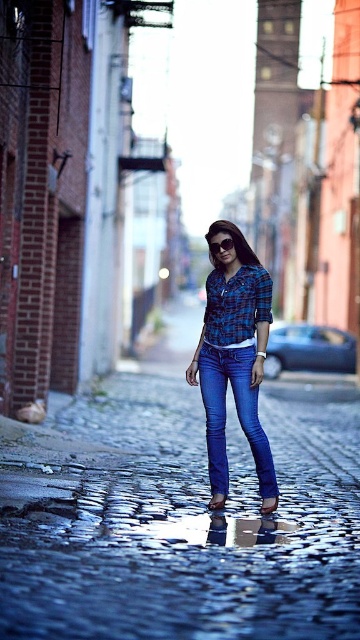
Question: Which point appears farthest from the camera in this image?

Choices:
 (A) (262, 368)
 (B) (249, 442)

Answer: (B)

Question: Observing the image, what is the correct spatial positioning of blue plaid shirt at center in reference to transparent plastic goggles at center?

Choices:
 (A) left
 (B) right

Answer: (B)

Question: Which point is closer to the camera?

Choices:
 (A) (227, 240)
 (B) (254, 444)
 (C) (135, 596)

Answer: (C)

Question: Can you confirm if blue denim jeans at center is positioned below transparent plastic goggles at center?

Choices:
 (A) no
 (B) yes

Answer: (B)

Question: Is blue denim jeans at center smaller than transparent plastic goggles at center?

Choices:
 (A) no
 (B) yes

Answer: (A)

Question: Which object is farther from the camera taking this photo?

Choices:
 (A) blue plaid shirt at center
 (B) shiny cobblestone street at center
 (C) blue denim jeans at center

Answer: (A)